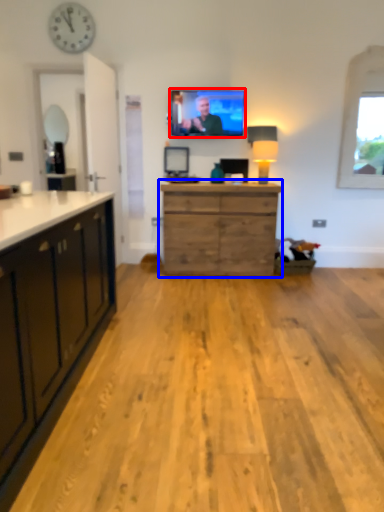
Question: Among these objects, which one is nearest to the camera, television (highlighted by a red box) or chest of drawers (highlighted by a blue box)?

Choices:
 (A) television
 (B) chest of drawers

Answer: (B)